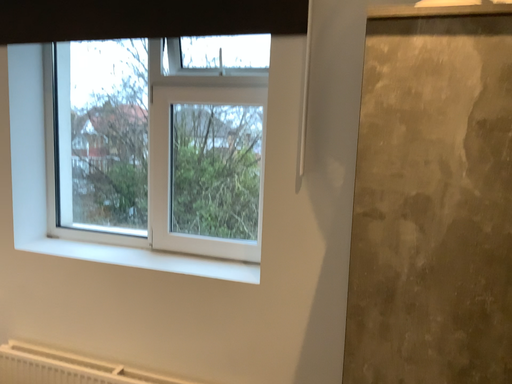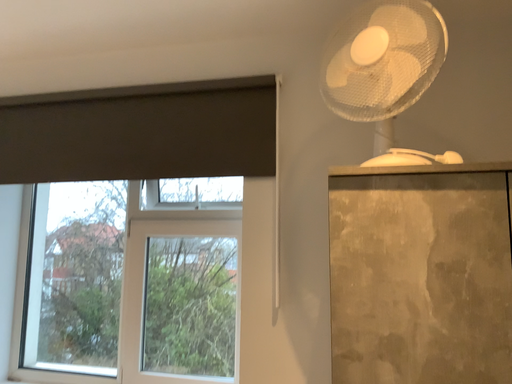
Question: How did the camera likely rotate when shooting the video?

Choices:
 (A) rotated downward
 (B) rotated upward

Answer: (B)